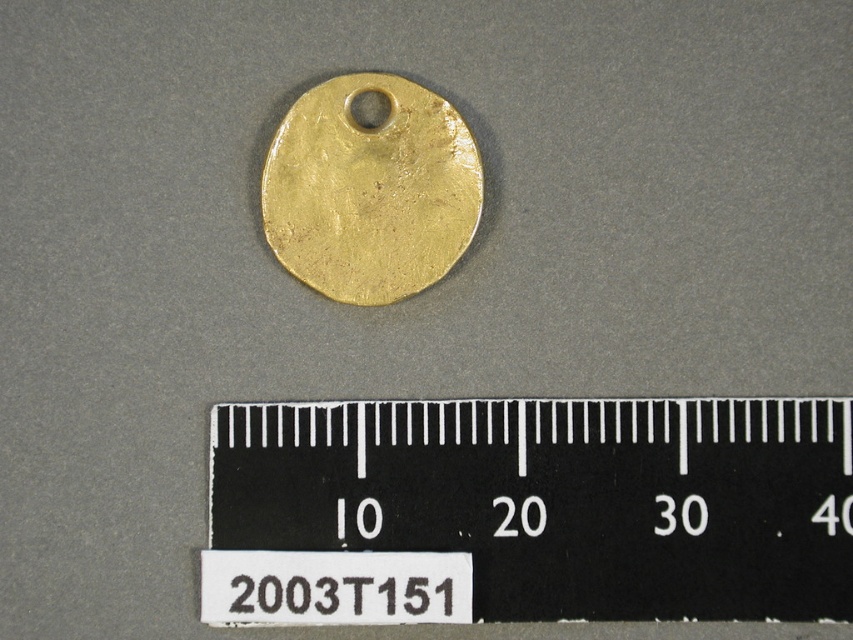
Between black plastic ruler at center and gold matte disc at center, which one is positioned lower?

Positioned lower is black plastic ruler at center.

Which is more to the left, black plastic ruler at center or gold matte disc at center?

gold matte disc at center

Where is `black plastic ruler at center`? black plastic ruler at center is located at coordinates (x=529, y=509).

Locate an element on the screen. black plastic ruler at center is located at coordinates (529, 509).